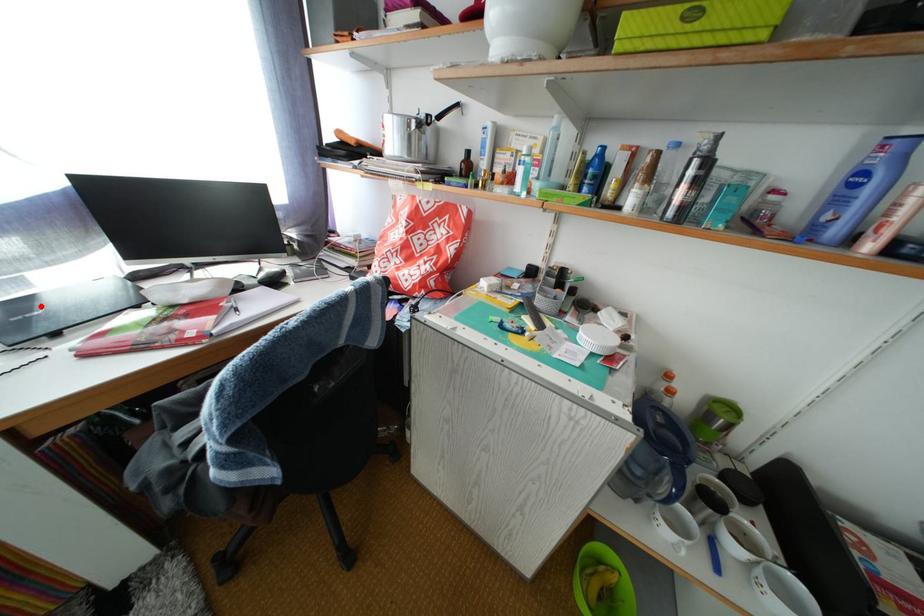
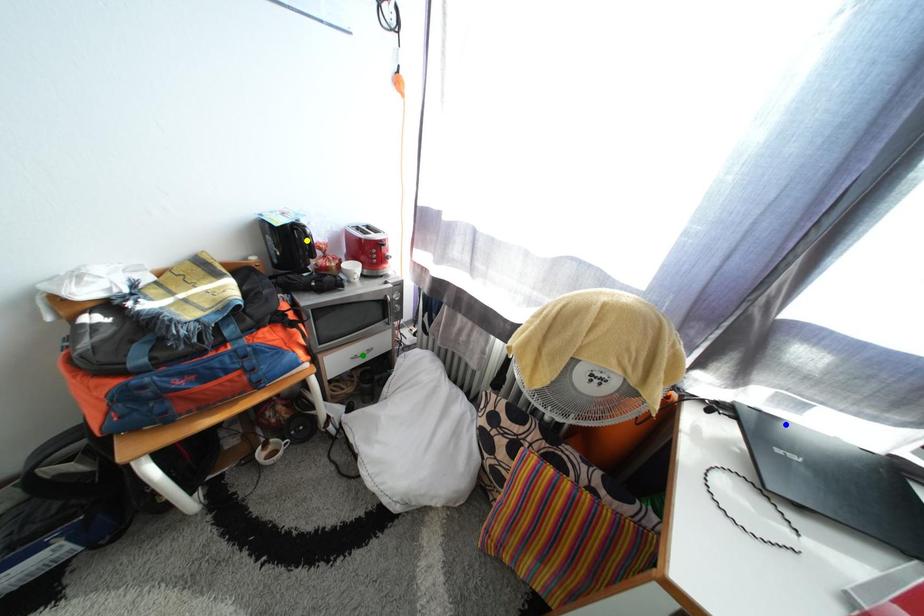
Question: I am providing you with two images of the same scene from different viewpoints. A red point is marked on the first image. You are given multiple points on the second image. In image 2, which mark is for the same physical point as the one in image 1?

Choices:
 (A) blue point
 (B) green point
 (C) yellow point

Answer: (A)